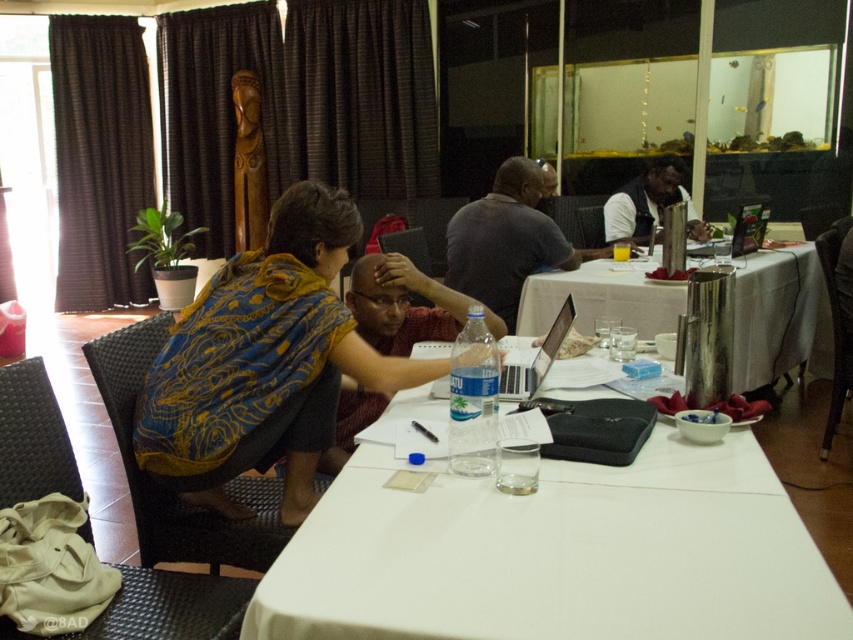
What are the coordinates of `matte black laptop at center` in the screenshot? It's located at (537, 358).

Does matte black laptop at center have a lesser height compared to matte black laptop at upper right?

Yes, matte black laptop at center is shorter than matte black laptop at upper right.

In order to click on matte black laptop at center in this screenshot , I will do `click(537, 358)`.

The width and height of the screenshot is (853, 640). Find the location of `matte black laptop at center`. matte black laptop at center is located at coordinates (537, 358).

Where is `dark blue shirt at center`? This screenshot has width=853, height=640. dark blue shirt at center is located at coordinates (648, 204).

What do you see at coordinates (648, 204) in the screenshot? I see `dark blue shirt at center` at bounding box center [648, 204].

You are a GUI agent. You are given a task and a screenshot of the screen. Output one action in this format:
    pyautogui.click(x=<x>, y=<y>)
    Task: Click on the dark blue shirt at center
    The image size is (853, 640).
    Given the screenshot: What is the action you would take?
    coord(648,204)

Between matte plastic water bottle at center and matte black laptop at center, which one appears on the left side from the viewer's perspective?

matte plastic water bottle at center

Can you confirm if matte plastic water bottle at center is smaller than matte black laptop at center?

Incorrect, matte plastic water bottle at center is not smaller in size than matte black laptop at center.

Find the location of a particular element. The height and width of the screenshot is (640, 853). matte plastic water bottle at center is located at coordinates (399, 305).